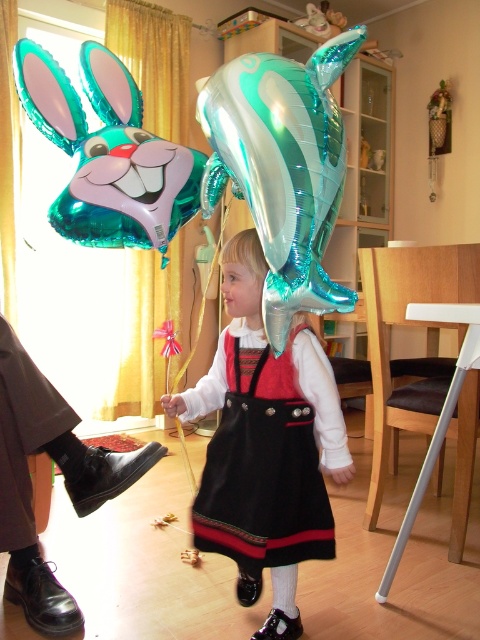
Question: Estimate the real-world distances between objects in this image. Which object is farther from the teal metallic balloon at upper left?

Choices:
 (A) teal metallic dolphin at upper center
 (B) black fabric dress at center

Answer: (B)

Question: Which point is farther from the camera taking this photo?

Choices:
 (A) (105, 58)
 (B) (321, 74)

Answer: (A)

Question: Can you confirm if teal metallic dolphin at upper center is positioned to the right of teal metallic balloon at upper left?

Choices:
 (A) yes
 (B) no

Answer: (A)

Question: Does teal metallic balloon at upper left appear over black fabric dress at center?

Choices:
 (A) yes
 (B) no

Answer: (A)

Question: Which of the following is the farthest from the observer?

Choices:
 (A) (131, 200)
 (B) (236, 342)
 (C) (309, 150)
 (D) (269, 364)

Answer: (A)

Question: Is teal metallic dolphin at upper center wider than black fabric dress at center?

Choices:
 (A) yes
 (B) no

Answer: (B)